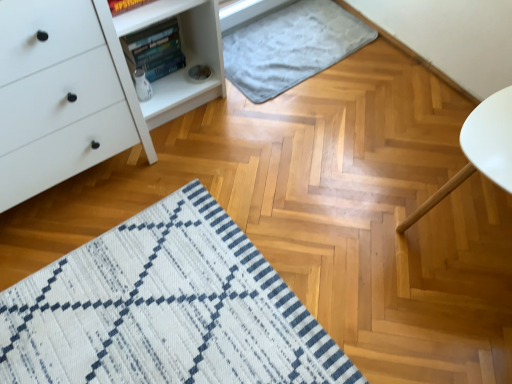
Question: Is hardcover book at upper left positioned with its back to gray soft rug at upper center?

Choices:
 (A) yes
 (B) no

Answer: (B)

Question: Are hardcover book at upper left and gray soft rug at upper center located far from each other?

Choices:
 (A) yes
 (B) no

Answer: (B)

Question: Is hardcover book at upper left taller than gray soft rug at upper center?

Choices:
 (A) yes
 (B) no

Answer: (A)

Question: Does hardcover book at upper left appear on the right side of gray soft rug at upper center?

Choices:
 (A) yes
 (B) no

Answer: (B)

Question: Is hardcover book at upper left next to gray soft rug at upper center and touching it?

Choices:
 (A) yes
 (B) no

Answer: (B)

Question: Is hardcover book at upper left completely or partially outside of gray soft rug at upper center?

Choices:
 (A) yes
 (B) no

Answer: (A)

Question: Is hardcover book at upper left facing away from white matte chest of drawers at left?

Choices:
 (A) yes
 (B) no

Answer: (B)

Question: Does hardcover book at upper left touch white matte chest of drawers at left?

Choices:
 (A) no
 (B) yes

Answer: (A)

Question: Is hardcover book at upper left in front of white matte chest of drawers at left?

Choices:
 (A) yes
 (B) no

Answer: (B)

Question: Is hardcover book at upper left positioned behind white matte chest of drawers at left?

Choices:
 (A) yes
 (B) no

Answer: (A)

Question: Does hardcover book at upper left have a greater width compared to white matte chest of drawers at left?

Choices:
 (A) no
 (B) yes

Answer: (A)

Question: From the image's perspective, is hardcover book at upper left under white matte chest of drawers at left?

Choices:
 (A) no
 (B) yes

Answer: (A)

Question: From the image's perspective, is white matte chest of drawers at left on gray soft rug at upper center?

Choices:
 (A) no
 (B) yes

Answer: (A)